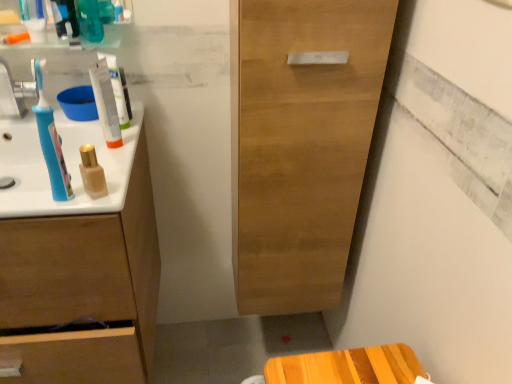
Question: Is blue plastic toothbrush at left facing away from matte beige bottle at center, the 1th mouthwash viewed from the front?

Choices:
 (A) no
 (B) yes

Answer: (A)

Question: Is blue plastic toothbrush at left at the left side of matte beige bottle at center, the first mouthwash from the bottom?

Choices:
 (A) no
 (B) yes

Answer: (B)

Question: Is blue plastic toothbrush at left behind matte beige bottle at center, the first mouthwash from the bottom?

Choices:
 (A) no
 (B) yes

Answer: (A)

Question: Does blue plastic toothbrush at left have a lesser height compared to matte beige bottle at center, the 2th mouthwash in the back-to-front sequence?

Choices:
 (A) yes
 (B) no

Answer: (B)

Question: Is blue plastic toothbrush at left facing towards matte beige bottle at center, the 2th mouthwash in the back-to-front sequence?

Choices:
 (A) yes
 (B) no

Answer: (B)

Question: Is point (65, 180) positioned closer to the camera than point (332, 46)?

Choices:
 (A) closer
 (B) farther

Answer: (A)

Question: Visually, is blue plastic toothbrush at left positioned to the left or to the right of light brown wood cabinet at center?

Choices:
 (A) left
 (B) right

Answer: (A)

Question: Would you say blue plastic toothbrush at left is inside or outside light brown wood cabinet at center?

Choices:
 (A) inside
 (B) outside

Answer: (B)

Question: From a real-world perspective, is blue plastic toothbrush at left positioned above or below light brown wood cabinet at center?

Choices:
 (A) above
 (B) below

Answer: (A)

Question: From the image's perspective, is teal glossy mouthwash at upper left, the first mouthwash when ordered from top to bottom, positioned above or below blue plastic toothbrush at left?

Choices:
 (A) below
 (B) above

Answer: (B)

Question: In terms of size, does teal glossy mouthwash at upper left, which is the 2th mouthwash from right to left, appear bigger or smaller than blue plastic toothbrush at left?

Choices:
 (A) small
 (B) big

Answer: (A)

Question: In terms of height, does teal glossy mouthwash at upper left, which is the 2th mouthwash from right to left, look taller or shorter compared to blue plastic toothbrush at left?

Choices:
 (A) short
 (B) tall

Answer: (B)

Question: From a real-world perspective, is teal glossy mouthwash at upper left, the first mouthwash positioned from the back, physically located above or below blue plastic toothbrush at left?

Choices:
 (A) below
 (B) above

Answer: (B)

Question: Considering the positions of point (58, 145) and point (40, 193), is point (58, 145) closer or farther from the camera than point (40, 193)?

Choices:
 (A) farther
 (B) closer

Answer: (A)

Question: Considering the positions of blue plastic toothbrush at left and white glossy sink at left in the image, is blue plastic toothbrush at left taller or shorter than white glossy sink at left?

Choices:
 (A) short
 (B) tall

Answer: (B)